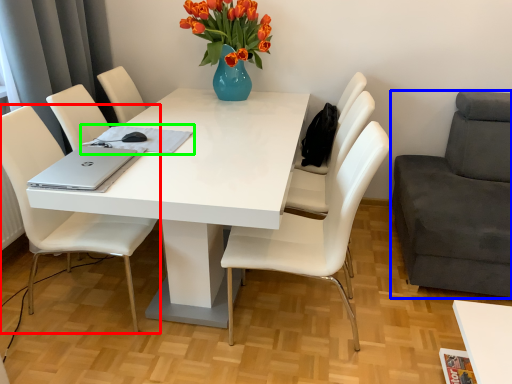
Question: Considering the real-world distances, which object is closest to chair (highlighted by a red box)? chair (highlighted by a blue box) or notepad (highlighted by a green box).

Choices:
 (A) chair
 (B) notepad

Answer: (B)